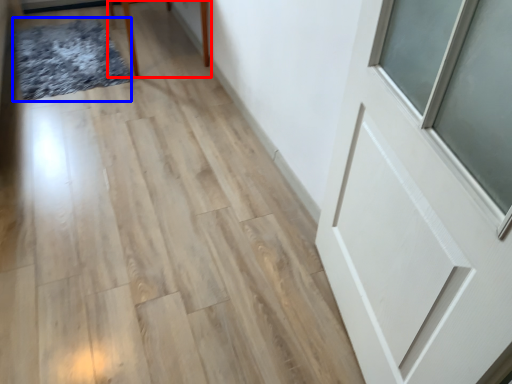
Question: Which object is closer to the camera taking this photo, furniture (highlighted by a red box) or mat (highlighted by a blue box)?

Choices:
 (A) furniture
 (B) mat

Answer: (A)